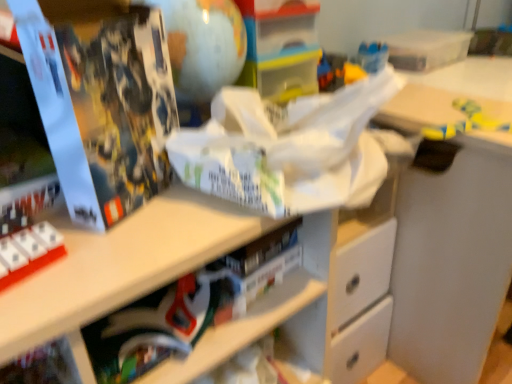
Question: Does matte black book at lower center have a larger size compared to matte black book at left?

Choices:
 (A) no
 (B) yes

Answer: (A)

Question: Is the depth of matte black book at lower center less than that of matte black book at left?

Choices:
 (A) no
 (B) yes

Answer: (A)

Question: Is matte black book at lower center turned away from matte black book at left?

Choices:
 (A) yes
 (B) no

Answer: (B)

Question: Does matte black book at lower center lie behind matte black book at left?

Choices:
 (A) yes
 (B) no

Answer: (A)

Question: From the image's perspective, is matte black book at lower center located above matte black book at left?

Choices:
 (A) yes
 (B) no

Answer: (B)

Question: Is matte black book at lower center surrounding matte black book at left?

Choices:
 (A) no
 (B) yes

Answer: (A)

Question: From a real-world perspective, is matte black book at left physically above yellow matte toy at upper right?

Choices:
 (A) yes
 (B) no

Answer: (A)

Question: Is matte black book at left positioned before yellow matte toy at upper right?

Choices:
 (A) yes
 (B) no

Answer: (A)

Question: From a real-world perspective, is matte black book at left beneath yellow matte toy at upper right?

Choices:
 (A) yes
 (B) no

Answer: (B)

Question: Is matte black book at left oriented away from yellow matte toy at upper right?

Choices:
 (A) no
 (B) yes

Answer: (A)

Question: Would you say matte black book at left is outside yellow matte toy at upper right?

Choices:
 (A) yes
 (B) no

Answer: (A)

Question: Is matte black book at left taller than yellow matte toy at upper right?

Choices:
 (A) no
 (B) yes

Answer: (B)

Question: Could you tell me if matte black book at lower center is facing yellow matte toy at upper right?

Choices:
 (A) no
 (B) yes

Answer: (A)